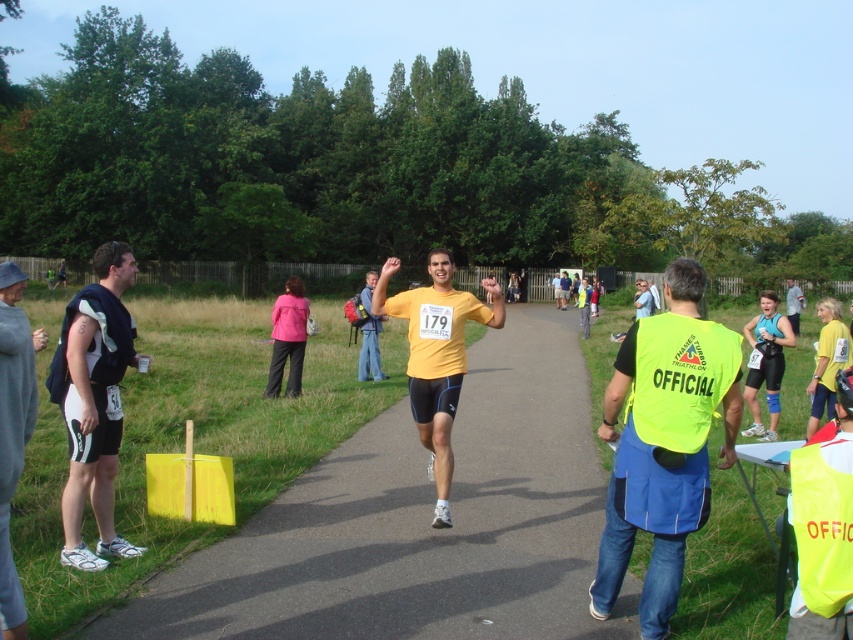
You are a participant in the triathlon and you see two points marked in the scene. The first point is at coordinate point (111, 449) and the second point is at coordinate point (375, 371). Which point is closer to you?

Point (111, 449) is closer to the viewer than point (375, 371).

You are a photographer standing at the finish line of a triathlon. You need to capture a photo of both the matte black shorts at left and the yellow matte triathlon suit at center. Which object should you zoom in on to ensure both are in frame without moving your position?

Since the matte black shorts at left might be wider than the yellow matte triathlon suit at center, you should zoom in on the yellow matte triathlon suit at center to ensure both are in frame without moving your position.